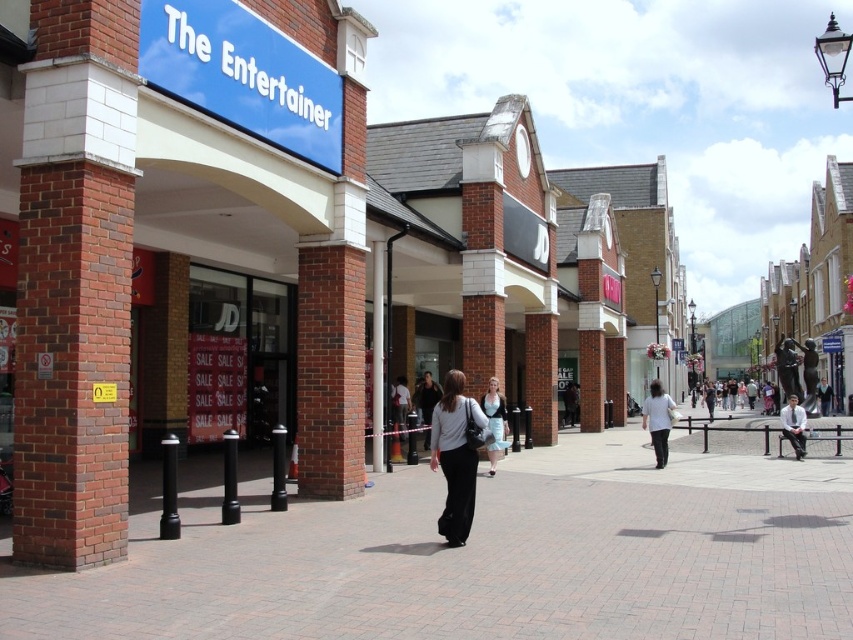
Question: Which point is farther to the camera?

Choices:
 (A) brick pavement at center
 (B) white shirt at center
 (C) light gray fabric pants at center
 (D) light blue dress at center

Answer: (B)

Question: Estimate the real-world distances between objects in this image. Which object is closer to the white fabric shirt at center?

Choices:
 (A) white fabric bag at center
 (B) light gray fabric pants at center

Answer: (A)

Question: Considering the relative positions of light gray fabric pants at center and white shirt at center in the image provided, where is light gray fabric pants at center located with respect to white shirt at center?

Choices:
 (A) right
 (B) left

Answer: (B)

Question: Is brick pavement at center positioned in front of dark gray fabric jacket at center?

Choices:
 (A) no
 (B) yes

Answer: (B)

Question: Which object is closer to the camera taking this photo?

Choices:
 (A) white fabric shirt at center
 (B) light blue dress at center
 (C) brick pavement at center
 (D) white shirt at center

Answer: (C)

Question: Does light blue dress at center appear on the right side of white fabric bag at center?

Choices:
 (A) yes
 (B) no

Answer: (A)